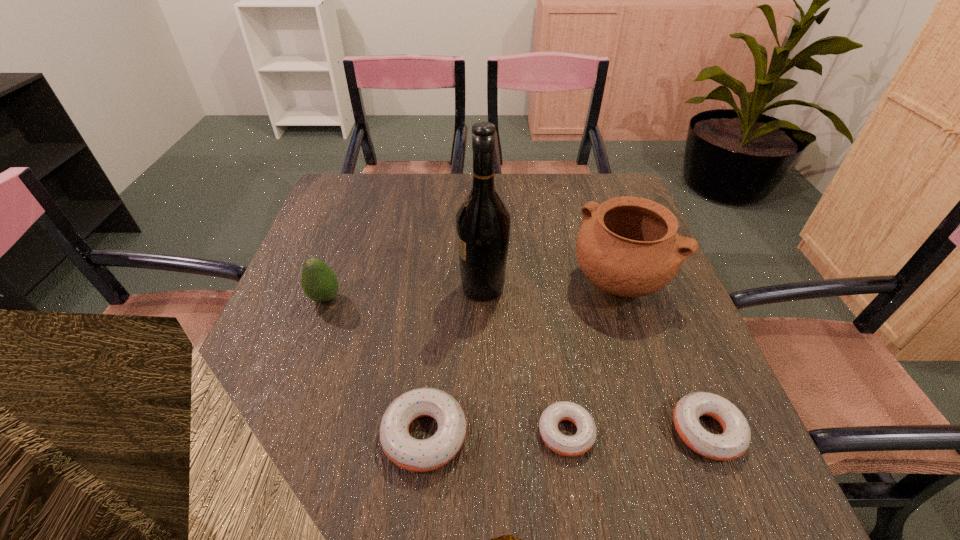
At what (x,y) coordinates should I click in order to perform the action: click on free space between the leftmost doughnut and the rightmost doughnut. Please return your answer as a coordinate pair (x, y). Looking at the image, I should click on (565, 433).

Locate an element on the screen. The height and width of the screenshot is (540, 960). vacant area between the rightmost doughnut and the shortest doughnut is located at coordinates (636, 432).

Where is `empty space that is in between the pottery and the tallest object`? The image size is (960, 540). empty space that is in between the pottery and the tallest object is located at coordinates (552, 286).

What are the coordinates of `free spot between the second tallest doughnut and the shortest object` in the screenshot? It's located at (636, 432).

Where is `free space between the leftmost object and the leftmost doughnut`? The width and height of the screenshot is (960, 540). free space between the leftmost object and the leftmost doughnut is located at coordinates (374, 367).

Where is `vacant area that lies between the wine bottle and the second doughnut from left to right`? The width and height of the screenshot is (960, 540). vacant area that lies between the wine bottle and the second doughnut from left to right is located at coordinates (524, 360).

Find the location of a particular element. free area in between the fifth tallest object and the fourth tallest object is located at coordinates (565, 433).

Locate an element on the screen. The image size is (960, 540). object that is the fourth nearest to the tallest object is located at coordinates (319, 282).

Locate which object is the fifth closest to the pottery. Please provide its 2D coordinates. Your answer should be formatted as a tuple, i.e. [(x, y)], where the tuple contains the x and y coordinates of a point satisfying the conditions above.

[(319, 282)]

Where is `doughnut that is the closest to the second shortest doughnut`? doughnut that is the closest to the second shortest doughnut is located at coordinates (570, 446).